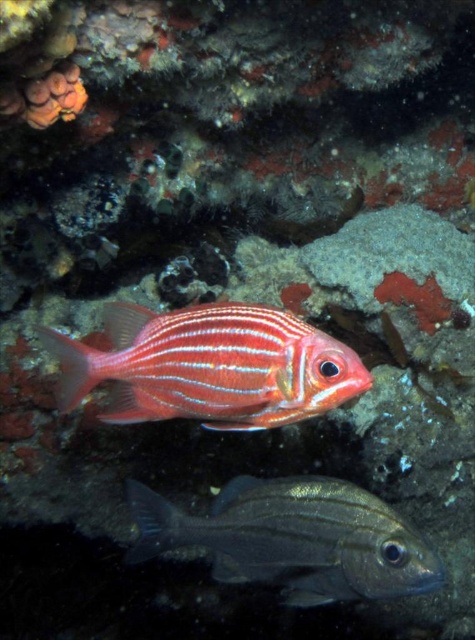
You are a marine biologist observing an underwater scene. You notice two fish, the shiny red fish at center and the shiny silver fish at center. Which fish is located above the other?

The shiny red fish at center is positioned over the shiny silver fish at center, so the shiny red fish is above the shiny silver fish.

You are a scuba diver swimming in the underwater scene. You notice two points marked in the image. The first point is at coordinates point (294, 380) and the second point is at point (419, 579). Which point is closer to you?

Point (294, 380) is closer to the viewer than point (419, 579).